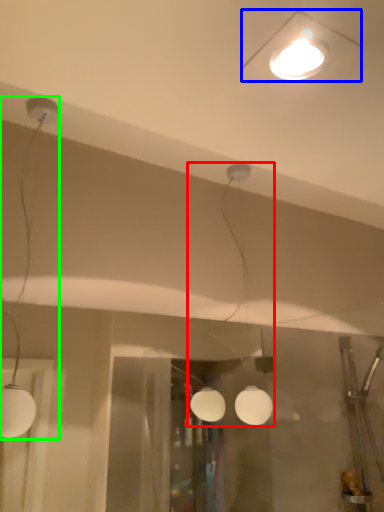
Question: Which object is positioned farthest from lamp (highlighted by a red box)? Select from lamp (highlighted by a blue box) and lamp (highlighted by a green box).

Choices:
 (A) lamp
 (B) lamp

Answer: (B)